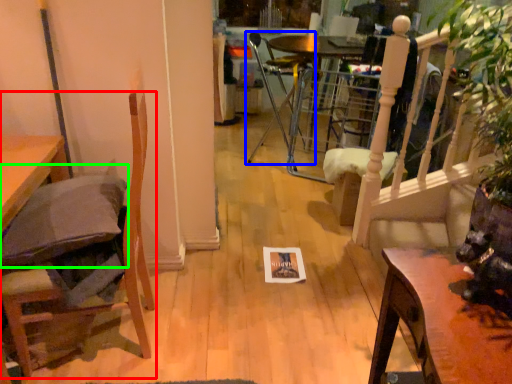
Question: Estimate the real-world distances between objects in this image. Which object is closer to chair (highlighted by a red box), chair (highlighted by a blue box) or pillow (highlighted by a green box)?

Choices:
 (A) chair
 (B) pillow

Answer: (B)